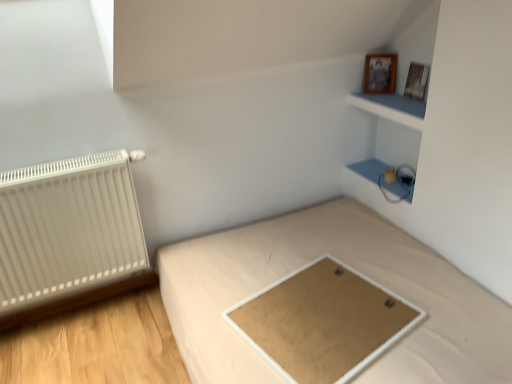
The height and width of the screenshot is (384, 512). I want to click on free space that is to the left of matte brown board at center, so click(218, 300).